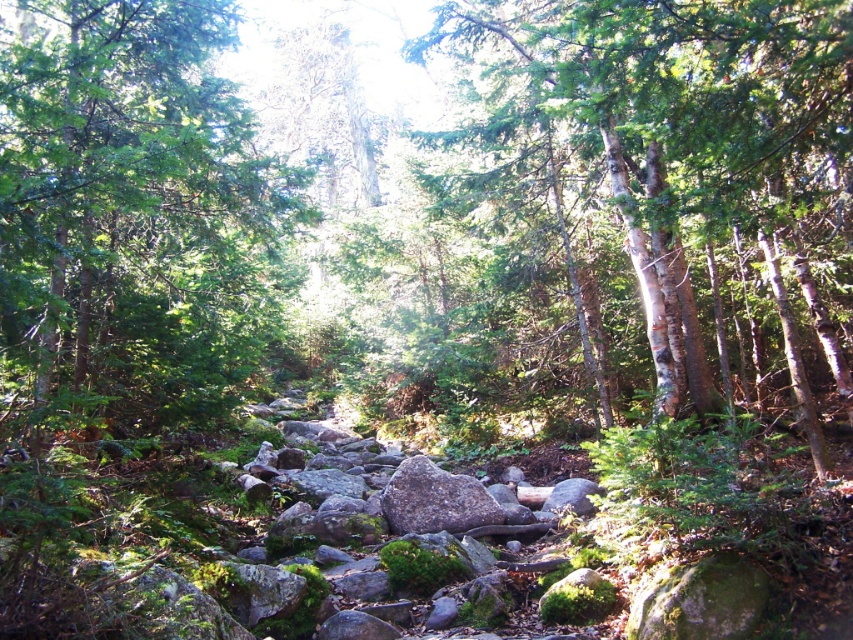
Can you confirm if smooth bark tree at center is bigger than green leafy tree at center?

Indeed, smooth bark tree at center has a larger size compared to green leafy tree at center.

Is smooth bark tree at center positioned at the back of green leafy tree at center?

That is True.

Who is more forward, (490, 80) or (194, 385)?

Point (194, 385)

Locate an element on the screen. The height and width of the screenshot is (640, 853). smooth bark tree at center is located at coordinates (683, 163).